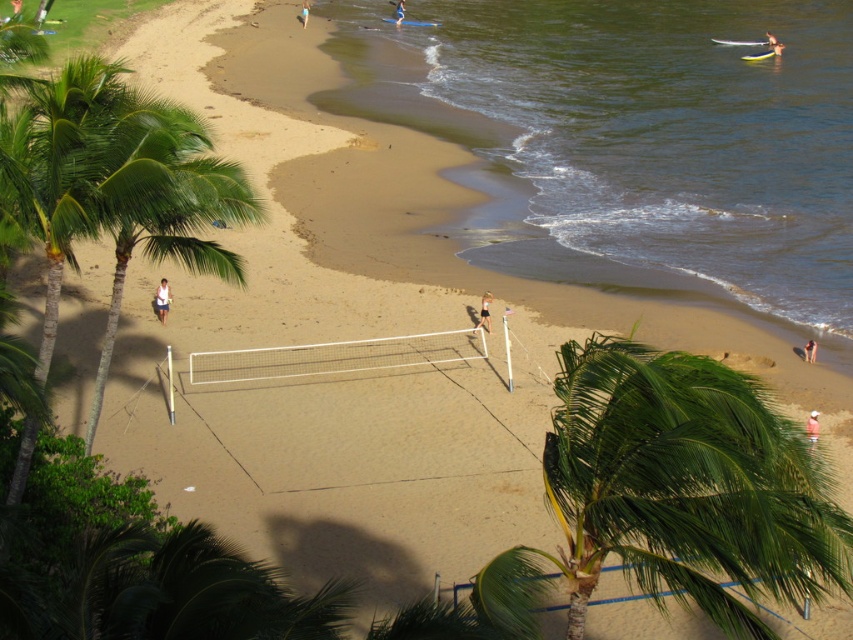
You are a photographer standing at the edge of the volleyball court. You want to capture a photo of both the pink fabric shorts at lower right and the white fabric shorts at lower center in the same frame. Given that your camera has a 50mm lens, which has a field of view of approximately 46 degrees, can you estimate if both subjects will fit in the frame?

The pink fabric shorts at lower right is 113.39 meters from the white fabric shorts at lower center. With a 50mm lens having a 46 degree field of view, the maximum distance between two objects that can fit in the frame is approximately 100 meters. Since the distance between them is greater than this, they cannot both fit in the same frame.

You are a photographer standing at the edge of the volleyball court. You want to take a photo of the white cotton shirt at center without the green leafy palm tree at center blocking it. How should you adjust your position?

Move to the left or right so that the green leafy palm tree at center is no longer directly behind the white cotton shirt at center. Since the palm tree is positioned under the shirt, shifting sideways will allow you to frame the shirt without the tree obstructing it.